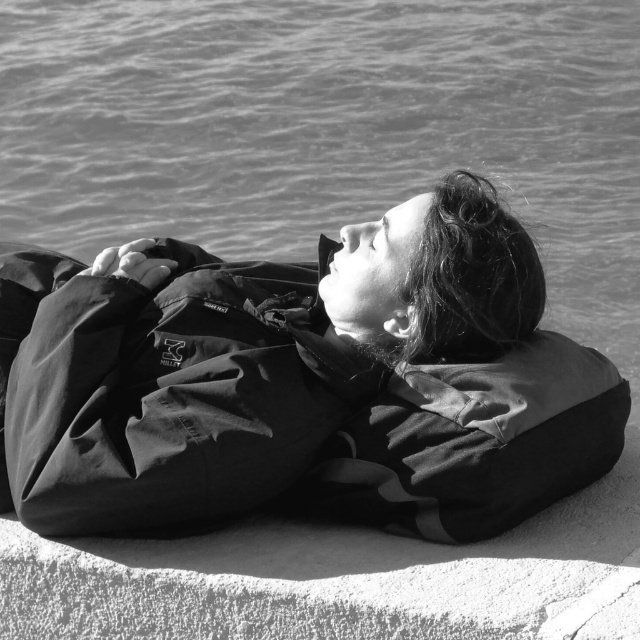
Question: Can you confirm if smooth water at upper center is positioned to the right of matte black jacket at center?

Choices:
 (A) no
 (B) yes

Answer: (A)

Question: Which object appears farthest from the camera in this image?

Choices:
 (A) matte black jacket at center
 (B) smooth water at upper center

Answer: (B)

Question: Which point is closer to the camera?

Choices:
 (A) smooth water at upper center
 (B) matte black jacket at center

Answer: (B)

Question: Is smooth water at upper center smaller than matte black jacket at center?

Choices:
 (A) yes
 (B) no

Answer: (B)

Question: Considering the relative positions of smooth water at upper center and matte black jacket at center in the image provided, where is smooth water at upper center located with respect to matte black jacket at center?

Choices:
 (A) left
 (B) right

Answer: (A)